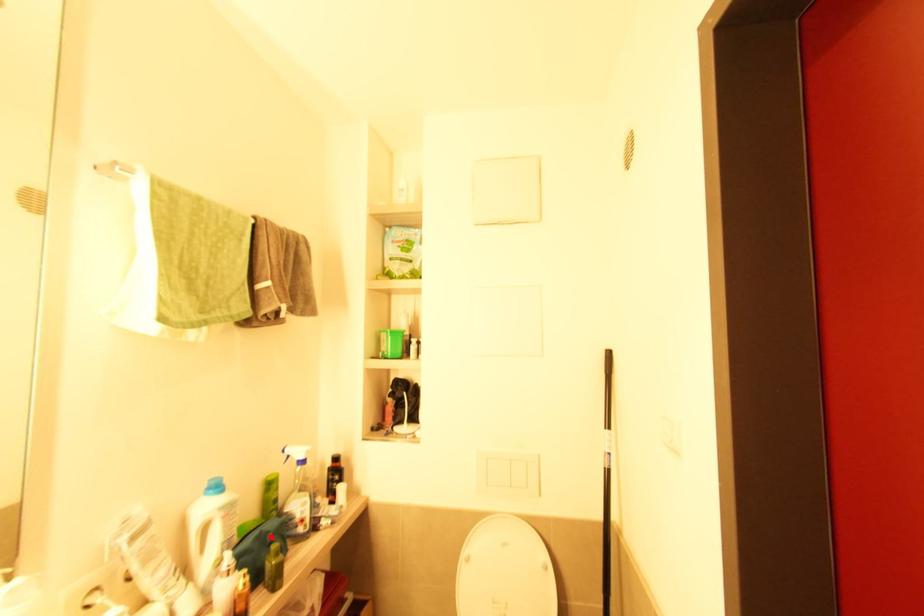
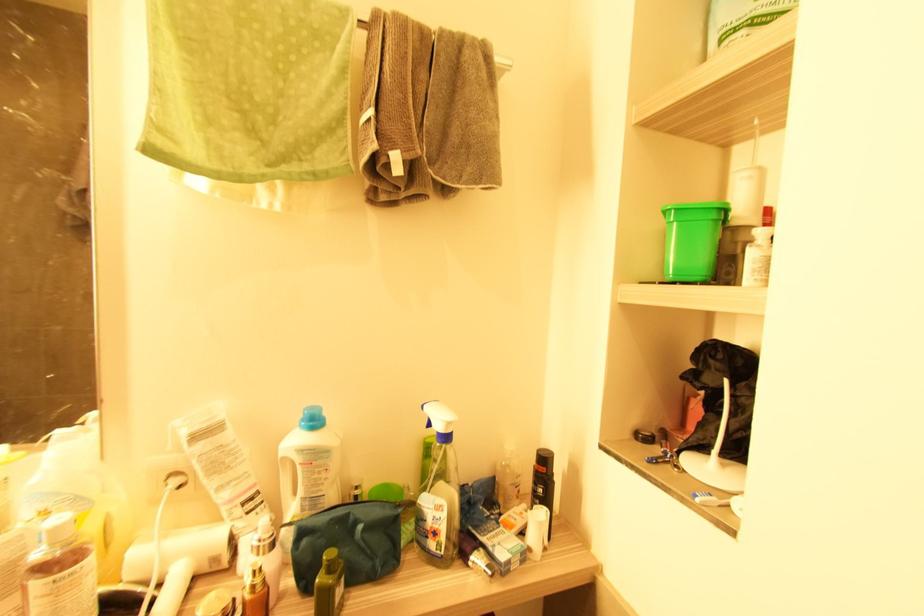
In the second image, find the point that corresponds to the highlighted location in the first image.

(361, 529)